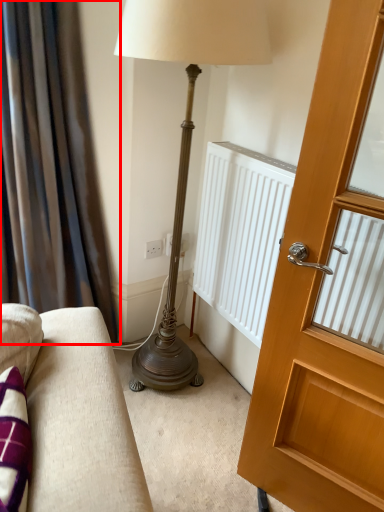
Question: From the image's perspective, considering the relative positions of curtain (annotated by the red box) and door in the image provided, where is curtain (annotated by the red box) located with respect to the staircase?

Choices:
 (A) below
 (B) above

Answer: (B)